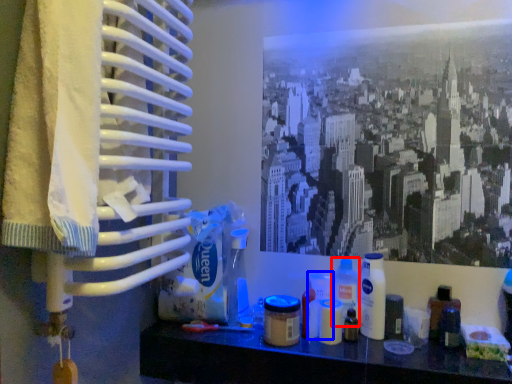
Question: Which point is further to the camera, cleaning product (highlighted by a red box) or toiletry (highlighted by a blue box)?

Choices:
 (A) cleaning product
 (B) toiletry

Answer: (B)